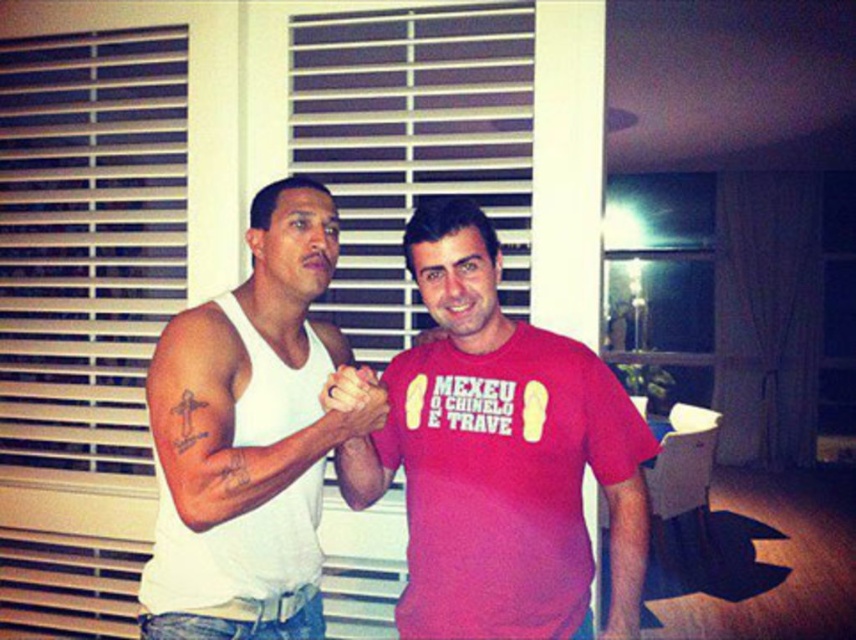
How distant is matte red t-shirt at center from matte pink t-shirt at center?

matte red t-shirt at center is 8.19 inches away from matte pink t-shirt at center.

Consider the image. Can you confirm if matte red t-shirt at center is positioned above matte pink t-shirt at center?

Indeed, matte red t-shirt at center is positioned over matte pink t-shirt at center.

Where is `matte red t-shirt at center`? matte red t-shirt at center is located at coordinates (500, 456).

This screenshot has width=856, height=640. I want to click on white smooth muscle at upper left, so click(x=224, y=422).

Which is more to the left, white smooth muscle at upper left or matte pink shirt at center?

white smooth muscle at upper left is more to the left.

Is point (226, 419) behind point (357, 422)?

No, it is not.

Locate an element on the screen. The image size is (856, 640). white smooth muscle at upper left is located at coordinates (224, 422).

I want to click on matte pink t-shirt at center, so tap(625, 548).

Who is lower down, matte pink t-shirt at center or white matte arm at center?

matte pink t-shirt at center is below.

Does point (632, 566) lie in front of point (367, 440)?

Yes, it is.

The image size is (856, 640). I want to click on matte pink t-shirt at center, so click(625, 548).